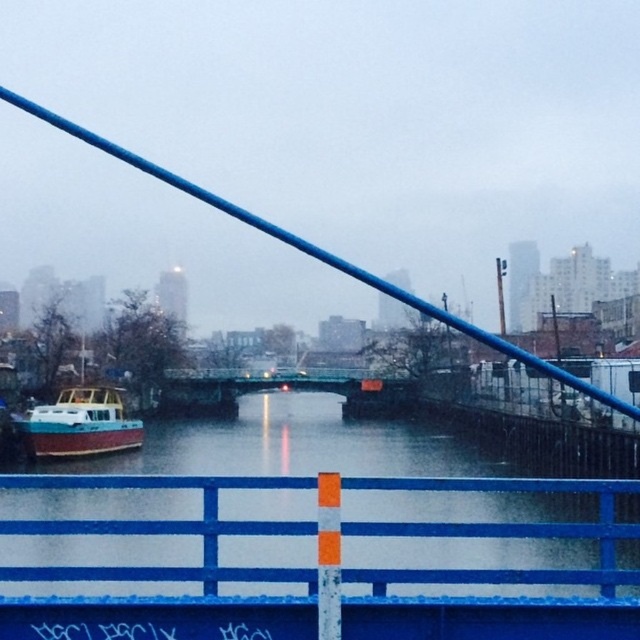
Is blue painted metal rail at center above teal wooden boat at left?

Indeed, blue painted metal rail at center is positioned over teal wooden boat at left.

Can you confirm if blue painted metal rail at center is taller than teal wooden boat at left?

In fact, blue painted metal rail at center may be shorter than teal wooden boat at left.

Does point (244, 604) come in front of point (12, 417)?

Yes, point (244, 604) is in front of point (12, 417).

The width and height of the screenshot is (640, 640). I want to click on blue painted metal rail at center, so click(333, 564).

Is smooth wooden boat at left to the left of blue painted metal rail at center from the viewer's perspective?

Correct, you'll find smooth wooden boat at left to the left of blue painted metal rail at center.

Which is behind, point (132, 525) or point (404, 605)?

The point (404, 605) is behind.

Find the location of a particular element. Image resolution: width=640 pixels, height=640 pixels. smooth wooden boat at left is located at coordinates (156, 531).

Can you confirm if smooth wooden boat at left is bigger than teal wooden boat at left?

Yes, smooth wooden boat at left is bigger than teal wooden boat at left.

Does smooth wooden boat at left have a lesser height compared to teal wooden boat at left?

No, smooth wooden boat at left is not shorter than teal wooden boat at left.

Identify the location of smooth wooden boat at left. (156, 531).